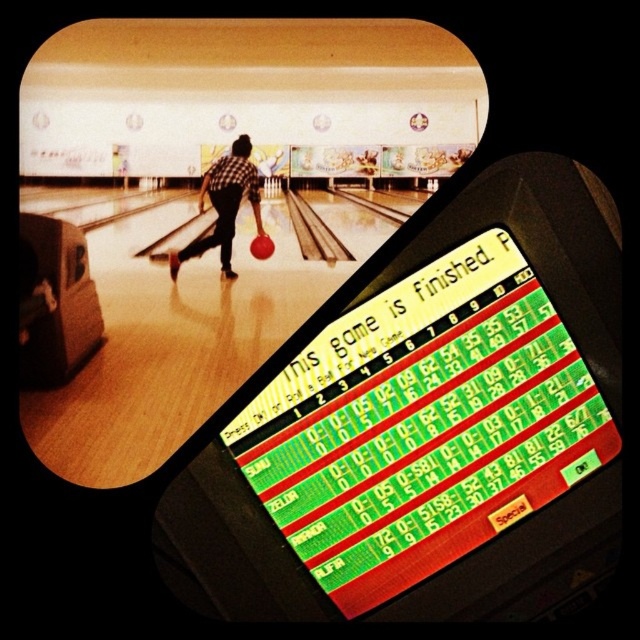
You are a photographer standing at the end of the bowling lane. You want to take a photo of the checkered fabric shirt at center and the shiny red bowling ball at center such that both are clearly visible. Considering their sizes, which object should you focus on first to ensure proper focus?

The checkered fabric shirt at center is much taller than the shiny red bowling ball at center, so you should focus on the checkered fabric shirt at center first to ensure proper focus due to its larger size.

You are a photographer trying to capture the perfect shot of the checkered fabric shirt at center and the shiny red bowling ball at center in the bowling alley scene. If you want to ensure both are in focus, which object should you adjust your camera focus on first?

The checkered fabric shirt at center is larger in size than the shiny red bowling ball at center, so you should focus on the checkered fabric shirt at center first to ensure both are in focus.

You are a photographer standing at the end of the bowling lane. You want to take a picture of both the checkered fabric shirt at center and the shiny red bowling ball at center. Which object should you focus on first if you want to capture them both clearly in the frame?

The checkered fabric shirt at center is positioned on the left side of the shiny red bowling ball at center, so you should focus on the checkered fabric shirt at center first to ensure both are in clear focus.